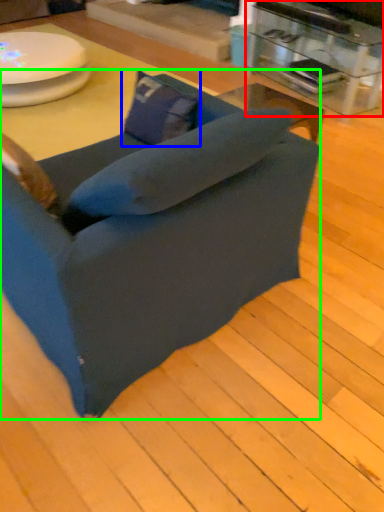
Question: Which object is positioned farthest from table (highlighted by a red box)? Select from pillow (highlighted by a blue box) and chair (highlighted by a green box).

Choices:
 (A) pillow
 (B) chair

Answer: (B)